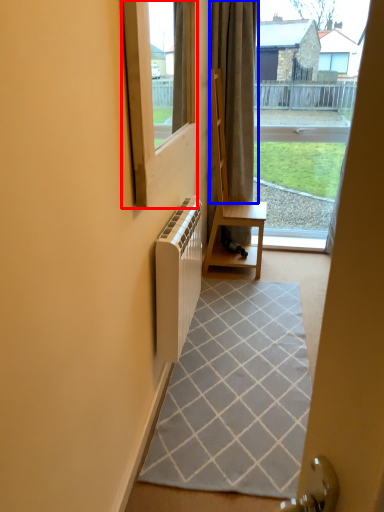
Question: Which object is closer to the camera taking this photo, window (highlighted by a red box) or curtain (highlighted by a blue box)?

Choices:
 (A) window
 (B) curtain

Answer: (A)